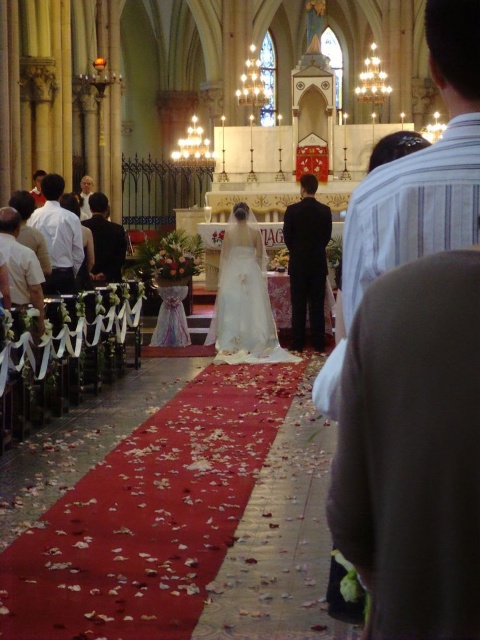
Does point (298, 205) come closer to viewer compared to point (13, 228)?

No, (298, 205) is behind (13, 228).

Describe the element at coordinates (307, 262) in the screenshot. I see `black satin suit at center` at that location.

Describe the element at coordinates (307, 262) in the screenshot. I see `black satin suit at center` at that location.

In order to click on black satin suit at center in this screenshot , I will do point(307,262).

Who is lower down, white satin dress at center or white cotton shirt at left?

white satin dress at center is lower down.

Is white satin dress at center positioned in front of white cotton shirt at left?

No, white satin dress at center is further to the viewer.

At what (x,y) coordinates should I click in order to perform the action: click on white satin dress at center. Please return your answer as a coordinate pair (x, y). Image resolution: width=480 pixels, height=640 pixels. Looking at the image, I should click on (243, 298).

Is light brown shirt at left further to camera compared to white cotton shirt at left?

Yes, light brown shirt at left is behind white cotton shirt at left.

How distant is light brown shirt at left from white cotton shirt at left?

light brown shirt at left and white cotton shirt at left are 4.25 meters apart from each other.

Between point (55, 179) and point (27, 278), which one is positioned in front?

Point (27, 278)

Identify the location of light brown shirt at left. This screenshot has width=480, height=640. (59, 236).